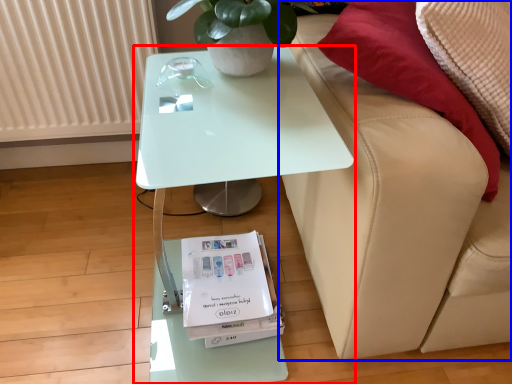
Question: Which object appears closest to the camera in this image, table (highlighted by a red box) or studio couch (highlighted by a blue box)?

Choices:
 (A) table
 (B) studio couch

Answer: (B)